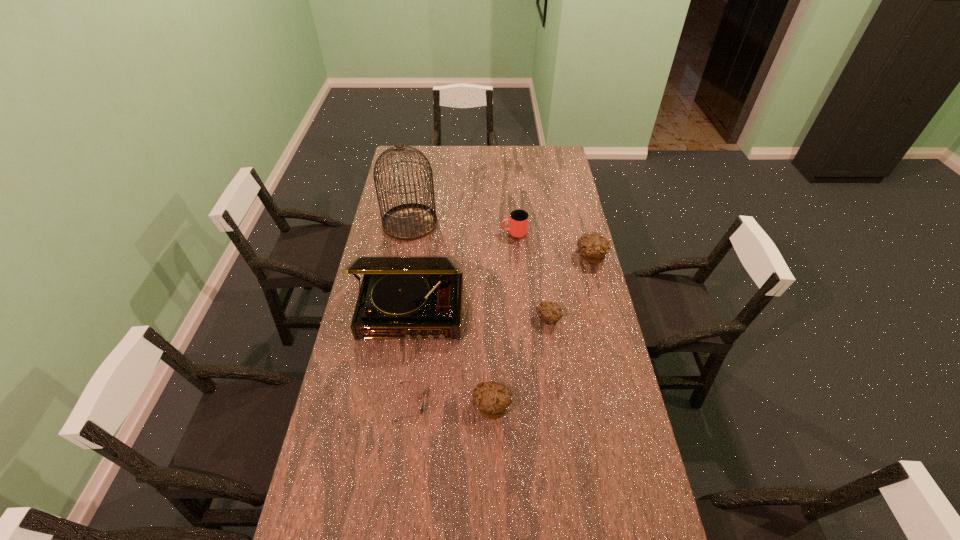
I want to click on free space located 0.090m on the right of the nearest muffin, so click(541, 406).

In order to click on free location located on the left of the second muffin from right to left in this screenshot , I will do `click(503, 320)`.

Locate an element on the screen. This screenshot has height=540, width=960. free space located on the front of the rightmost object is located at coordinates (599, 292).

Find the location of `vacant area situated 0.140m on the front of the tallest object`. vacant area situated 0.140m on the front of the tallest object is located at coordinates (403, 264).

This screenshot has height=540, width=960. I want to click on vacant space located on the handle side of the cup, so click(x=422, y=233).

Find the location of `vacant space situated on the handle side of the cup`. vacant space situated on the handle side of the cup is located at coordinates (456, 233).

This screenshot has width=960, height=540. I want to click on vacant area located on the handle side of the cup, so click(x=414, y=233).

Where is `vacant area situated 0.360m on the front-facing side of the record player`? vacant area situated 0.360m on the front-facing side of the record player is located at coordinates (394, 446).

Find the location of a particular element. free point located 0.110m on the lenses of the shortest object is located at coordinates (460, 403).

Identify the location of birdcage at the left edge. This screenshot has height=540, width=960. (410, 221).